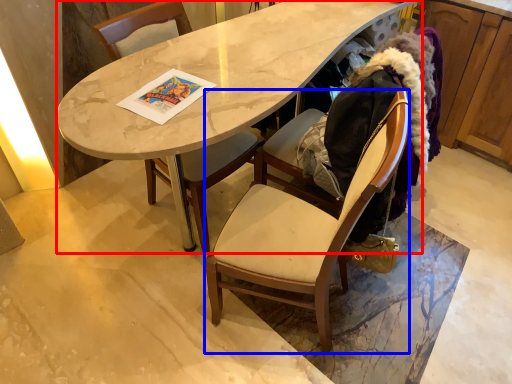
Question: Which point is further to the camera, desk (highlighted by a red box) or chair (highlighted by a blue box)?

Choices:
 (A) desk
 (B) chair

Answer: (A)